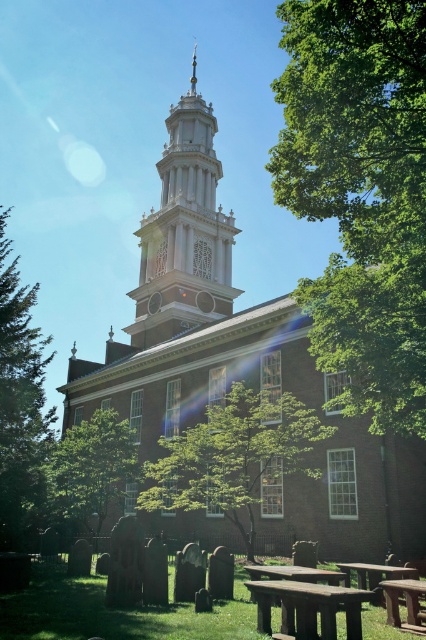
Does green leafy tree at upper right have a greater width compared to green grass at lower center?

Incorrect, green leafy tree at upper right's width does not surpass green grass at lower center's.

The image size is (426, 640). Find the location of `green leafy tree at upper right`. green leafy tree at upper right is located at coordinates (360, 193).

The height and width of the screenshot is (640, 426). I want to click on green leafy tree at upper right, so click(x=360, y=193).

Who is more distant from viewer, (x=233, y=515) or (x=195, y=618)?

The point (x=233, y=515) is more distant.

I want to click on green leafy tree at center, so click(x=233, y=456).

Where is `green leafy tree at center`? This screenshot has width=426, height=640. green leafy tree at center is located at coordinates (233, 456).

Can you confirm if green grass at lower center is positioned to the left of wooden picnic table at lower right?

Yes, green grass at lower center is to the left of wooden picnic table at lower right.

Can you confirm if green grass at lower center is wider than wooden picnic table at lower right?

Yes.

Identify the location of green grass at lower center. (115, 612).

You are a GUI agent. You are given a task and a screenshot of the screen. Output one action in this format:
    pyautogui.click(x=<x>, y=<y>)
    Task: Click on the green grass at lower center
    The height and width of the screenshot is (640, 426).
    Given the screenshot: What is the action you would take?
    pyautogui.click(x=115, y=612)